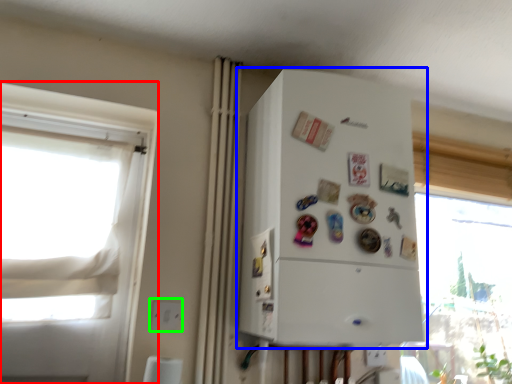
Question: Which object is positioned farthest from window (highlighted by a red box)? Select from refrigerator (highlighted by a blue box) and electric outlet (highlighted by a green box).

Choices:
 (A) refrigerator
 (B) electric outlet

Answer: (A)